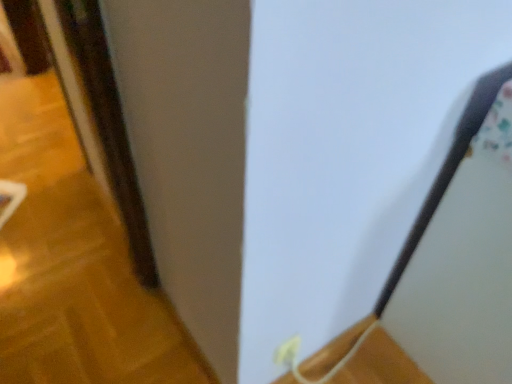
Question: Is white plastic electric outlet at lower center aimed at wooden at lower right?

Choices:
 (A) yes
 (B) no

Answer: (B)

Question: From a real-world perspective, is white plastic electric outlet at lower center below wooden at lower right?

Choices:
 (A) yes
 (B) no

Answer: (B)

Question: Could wooden at lower right be considered to be inside white plastic electric outlet at lower center?

Choices:
 (A) no
 (B) yes

Answer: (A)

Question: From the image's perspective, is white plastic electric outlet at lower center over wooden at lower right?

Choices:
 (A) yes
 (B) no

Answer: (A)

Question: Is the position of white plastic electric outlet at lower center more distant than that of wooden at lower right?

Choices:
 (A) yes
 (B) no

Answer: (B)

Question: Visually, is brown wooden door at left positioned to the left or to the right of white plastic electric outlet at lower center?

Choices:
 (A) left
 (B) right

Answer: (A)

Question: In terms of size, does brown wooden door at left appear bigger or smaller than white plastic electric outlet at lower center?

Choices:
 (A) small
 (B) big

Answer: (B)

Question: Considering their positions, is brown wooden door at left located in front of or behind white plastic electric outlet at lower center?

Choices:
 (A) behind
 (B) front

Answer: (A)

Question: Does point (35, 46) appear closer or farther from the camera than point (294, 357)?

Choices:
 (A) farther
 (B) closer

Answer: (A)

Question: Looking at their shapes, would you say white plastic electric outlet at lower center is wider or thinner than brown wooden door at left?

Choices:
 (A) thin
 (B) wide

Answer: (A)

Question: Looking at the image, does white plastic electric outlet at lower center seem bigger or smaller compared to brown wooden door at left?

Choices:
 (A) big
 (B) small

Answer: (B)

Question: In the image, is white plastic electric outlet at lower center positioned in front of or behind brown wooden door at left?

Choices:
 (A) behind
 (B) front

Answer: (B)

Question: From their relative heights in the image, would you say white plastic electric outlet at lower center is taller or shorter than brown wooden door at left?

Choices:
 (A) short
 (B) tall

Answer: (B)

Question: From the image's perspective, relative to white plastic electric outlet at lower center, is wooden at lower right above or below?

Choices:
 (A) above
 (B) below

Answer: (B)

Question: In terms of size, does wooden at lower right appear bigger or smaller than white plastic electric outlet at lower center?

Choices:
 (A) small
 (B) big

Answer: (B)